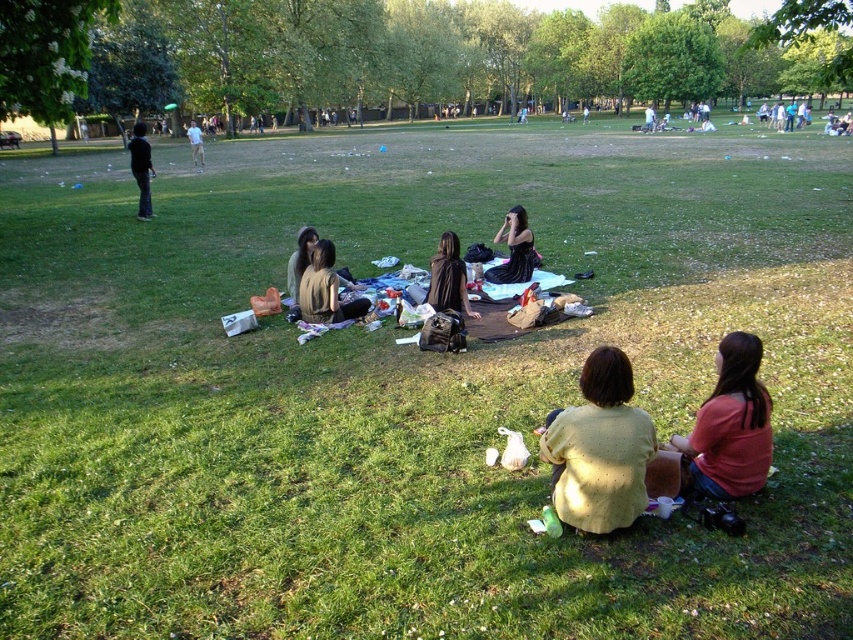
Between light yellow knit sweater at lower center and light brown leather jacket at upper left, which one is positioned higher?

light brown leather jacket at upper left is above.

Who is lower down, light yellow knit sweater at lower center or light brown leather jacket at upper left?

light yellow knit sweater at lower center is lower down.

Which is in front, point (556, 454) or point (194, 145)?

Point (556, 454) is more forward.

The image size is (853, 640). I want to click on light yellow knit sweater at lower center, so click(x=599, y=448).

Is point (677, 440) closer to camera compared to point (148, 172)?

Yes, point (677, 440) is in front of point (148, 172).

Is pink fabric at lower right above dark blue jeans at left?

Actually, pink fabric at lower right is below dark blue jeans at left.

Between point (762, 401) and point (135, 138), which one is positioned in front?

Point (762, 401)

You are a GUI agent. You are given a task and a screenshot of the screen. Output one action in this format:
    pyautogui.click(x=<x>, y=<y>)
    Task: Click on the pink fabric at lower right
    Image resolution: width=853 pixels, height=640 pixels.
    Given the screenshot: What is the action you would take?
    pyautogui.click(x=729, y=426)

Who is positioned more to the left, light yellow knit sweater at lower center or pink fabric at lower right?

From the viewer's perspective, light yellow knit sweater at lower center appears more on the left side.

Does light yellow knit sweater at lower center appear over pink fabric at lower right?

No, light yellow knit sweater at lower center is not above pink fabric at lower right.

You are a GUI agent. You are given a task and a screenshot of the screen. Output one action in this format:
    pyautogui.click(x=<x>, y=<y>)
    Task: Click on the light yellow knit sweater at lower center
    This screenshot has height=640, width=853.
    Given the screenshot: What is the action you would take?
    pyautogui.click(x=599, y=448)

In order to click on light yellow knit sweater at lower center in this screenshot , I will do `click(599, 448)`.